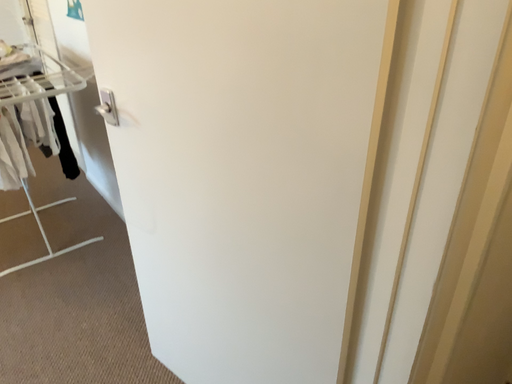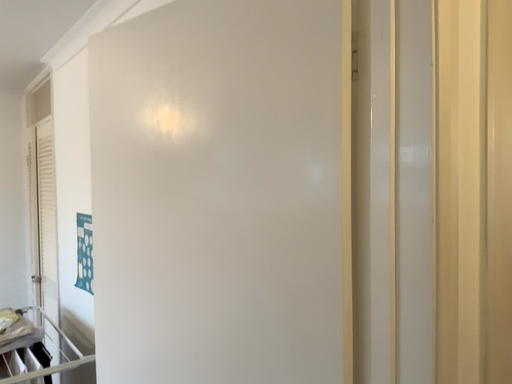
Question: Which way did the camera rotate in the video?

Choices:
 (A) rotated upward
 (B) rotated downward

Answer: (A)